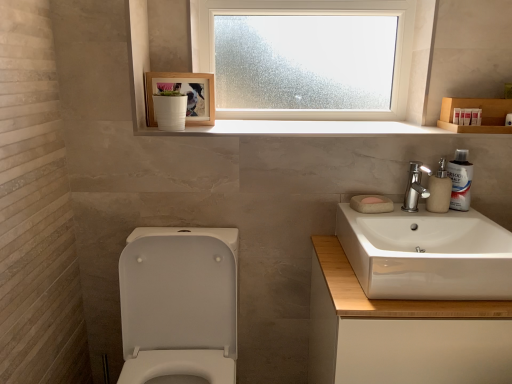
Measure the distance between frosted glass window at upper center and camera.

frosted glass window at upper center and camera are 4.97 feet apart from each other.

This screenshot has width=512, height=384. What are the coordinates of `frosted glass window at upper center` in the screenshot? It's located at (332, 14).

This screenshot has height=384, width=512. Describe the element at coordinates (460, 180) in the screenshot. I see `white glossy toothpaste tube at upper right` at that location.

Describe the element at coordinates (426, 254) in the screenshot. I see `white glossy sink at right` at that location.

Image resolution: width=512 pixels, height=384 pixels. Describe the element at coordinates (328, 128) in the screenshot. I see `white wood shelf at upper center` at that location.

The image size is (512, 384). Identify the location of polished chrome faucet at upper right. (415, 187).

The image size is (512, 384). Identify the location of white matte soap at sink. (372, 200).

From the picture: Is frosted glass window at upper center smaller than white glossy toothpaste tube at upper right?

No.

From the image's perspective, which is above, frosted glass window at upper center or white glossy toothpaste tube at upper right?

frosted glass window at upper center, from the image's perspective.

Is there a large distance between frosted glass window at upper center and white glossy toothpaste tube at upper right?

No, frosted glass window at upper center is in close proximity to white glossy toothpaste tube at upper right.

Between point (263, 117) and point (467, 198), which one is positioned behind?

Positioned behind is point (263, 117).

Is white matte soap at sink bigger or smaller than frosted glass window at upper center?

Answer: In the image, white matte soap at sink appears to be smaller than frosted glass window at upper center.

Can frosted glass window at upper center be found inside white matte soap at sink?

No, frosted glass window at upper center is located outside of white matte soap at sink.

Where is `soap that appears below the frosted glass window at upper center (from a real-world perspective)`? soap that appears below the frosted glass window at upper center (from a real-world perspective) is located at coordinates (372, 200).

Is white matte soap at sink wider than frosted glass window at upper center?

Incorrect, the width of white matte soap at sink does not surpass that of frosted glass window at upper center.

Which is more to the left, white matte soap at sink or matte beige soap dispenser at right?

From the viewer's perspective, white matte soap at sink appears more on the left side.

From the image's perspective, is white matte soap at sink beneath matte beige soap dispenser at right?

Correct, white matte soap at sink appears lower than matte beige soap dispenser at right in the image.

Can you confirm if white matte soap at sink is taller than matte beige soap dispenser at right?

In fact, white matte soap at sink may be shorter than matte beige soap dispenser at right.

Is white matte soap at sink directly adjacent to matte beige soap dispenser at right?

No.

In the scene shown: From a real-world perspective, which is physically below, white glossy toothpaste tube at upper right or white plastic toothpaste tube at upper right, the 2th toiletry viewed from the right?

white glossy toothpaste tube at upper right, from a real-world perspective.

What's the angular difference between white glossy toothpaste tube at upper right and white plastic toothpaste tube at upper right, the 2th toiletry viewed from the right,'s facing directions?

There is a 23.3-degree angle between the facing directions of white glossy toothpaste tube at upper right and white plastic toothpaste tube at upper right, the 2th toiletry viewed from the right.

Does white glossy toothpaste tube at upper right touch white plastic toothpaste tube at upper right, the 2th toiletry viewed from the right?

No.

Is white glossy toothpaste tube at upper right behind white plastic toothpaste tube at upper right, the 2th toiletry positioned from the left?

No, the depth of white glossy toothpaste tube at upper right is less than that of white plastic toothpaste tube at upper right, the 2th toiletry positioned from the left.

From a real-world perspective, which is physically above, white wood shelf at upper center or white matte soap at sink?

From a 3D spatial view, white wood shelf at upper center is above.

Is white matte soap at sink surrounded by white wood shelf at upper center?

Actually, white matte soap at sink is outside white wood shelf at upper center.

Find the location of a particular element. The image size is (512, 384). soap located underneath the white wood shelf at upper center (from a real-world perspective) is located at coordinates (372, 200).

Is white wood shelf at upper center closer to camera compared to white matte soap at sink?

No, the depth of white wood shelf at upper center is greater than that of white matte soap at sink.

Is point (422, 190) farther from camera compared to point (355, 10)?

No, (422, 190) is closer to viewer.

Is the position of polished chrome faucet at upper right less distant than that of frosted glass window at upper center?

Yes.

Does polished chrome faucet at upper right have a lesser width compared to frosted glass window at upper center?

Correct, the width of polished chrome faucet at upper right is less than that of frosted glass window at upper center.

Considering the positions of objects white glossy sink at right and white wood shelf at upper center in the image provided, who is more to the right, white glossy sink at right or white wood shelf at upper center?

white glossy sink at right.

Looking at this image, can you tell me how much white glossy sink at right and white wood shelf at upper center differ in facing direction?

There is a 0.117-degree angle between the facing directions of white glossy sink at right and white wood shelf at upper center.

Considering the positions of objects white glossy sink at right and white wood shelf at upper center in the image provided, who is in front, white glossy sink at right or white wood shelf at upper center?

white glossy sink at right is closer to the camera.

Who is shorter, white glossy sink at right or white wood shelf at upper center?

white wood shelf at upper center.

The width and height of the screenshot is (512, 384). In the image, there is a frosted glass window at upper center. Find the location of `cleaning product below it (from a real-world perspective)`. cleaning product below it (from a real-world perspective) is located at coordinates (460, 180).

The width and height of the screenshot is (512, 384). Find the location of `window on the left of white matte soap at sink`. window on the left of white matte soap at sink is located at coordinates (332, 14).

Consider the image. Considering their positions, is frosted glass window at upper center positioned closer to white wood cabinet at right than white plastic toothpaste tube at upper right, the first toiletry from the left?

Among the two, white plastic toothpaste tube at upper right, the first toiletry from the left, is located nearer to white wood cabinet at right.

From the image, which object appears to be nearer to wooden picture frame at upper center, white glossy toothpaste tube at upper right or frosted glass window at upper center?

frosted glass window at upper center is closer to wooden picture frame at upper center.

From the image, which object appears to be nearer to matte beige soap dispenser at right, white plastic toothpaste tube at upper right, the 2th toiletry viewed from the right, or white plastic toothpaste tube at upper right, arranged as the first toiletry when viewed from the right?

Based on the image, white plastic toothpaste tube at upper right, the 2th toiletry viewed from the right, appears to be nearer to matte beige soap dispenser at right.

When comparing their distances from white wood cabinet at right, does white wood shelf at upper center or white plastic toothpaste tube at upper right, which is counted as the third toiletry, starting from the right, seem closer?

white wood shelf at upper center is closer to white wood cabinet at right.

Which object lies nearer to the anchor point white matte soap at sink, white plastic toothpaste tube at upper right, the 2th toiletry viewed from the right, or white glossy sink at right?

Based on the image, white glossy sink at right appears to be nearer to white matte soap at sink.

Looking at the image, which one is located closer to white wood cabinet at right, white glossy sink at right or white glossy toilet at lower left?

Based on the image, white glossy sink at right appears to be nearer to white wood cabinet at right.

Which object lies further to the anchor point white matte soap at sink, white wood shelf at upper center or matte beige soap dispenser at right?

white wood shelf at upper center is positioned further to the anchor white matte soap at sink.

In the scene shown: Based on their spatial positions, is wooden picture frame at upper center or frosted glass window at upper center further from white plastic toothpaste tube at upper right, marked as the third toiletry in a left-to-right arrangement?

wooden picture frame at upper center.

You are a GUI agent. You are given a task and a screenshot of the screen. Output one action in this format:
    pyautogui.click(x=<x>, y=<y>)
    Task: Click on the cleaning product between frosted glass window at upper center and white plastic toothpaste tube at upper right, arranged as the first toiletry when viewed from the right, in the horizontal direction
    This screenshot has height=384, width=512.
    Given the screenshot: What is the action you would take?
    pyautogui.click(x=460, y=180)

Where is `toiletry between white matte soap at sink and white plastic toothpaste tube at upper right, the 2th toiletry positioned from the left, from left to right`? toiletry between white matte soap at sink and white plastic toothpaste tube at upper right, the 2th toiletry positioned from the left, from left to right is located at coordinates (457, 116).

The width and height of the screenshot is (512, 384). Identify the location of soap between wooden picture frame at upper center and white glossy toilet at lower left in the vertical direction. (372, 200).

You are a GUI agent. You are given a task and a screenshot of the screen. Output one action in this format:
    pyautogui.click(x=<x>, y=<y>)
    Task: Click on the soap between white glossy toilet at lower left and white plastic toothpaste tube at upper right, the first toiletry from the left
    The width and height of the screenshot is (512, 384).
    Given the screenshot: What is the action you would take?
    point(372,200)